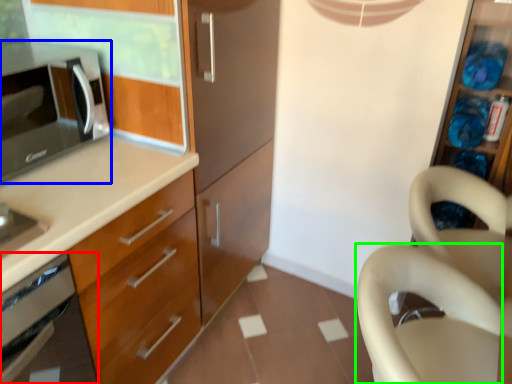
Question: Which object is the farthest from oven (highlighted by a red box)? Choose among these: microwave oven (highlighted by a blue box) or swivel chair (highlighted by a green box).

Choices:
 (A) microwave oven
 (B) swivel chair

Answer: (B)